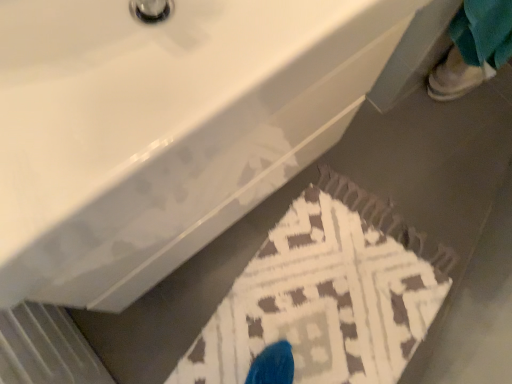
Question: Is white glossy sink at upper center turned away from brown textured rug at lower center?

Choices:
 (A) no
 (B) yes

Answer: (A)

Question: Does white glossy sink at upper center have a larger size compared to brown textured rug at lower center?

Choices:
 (A) no
 (B) yes

Answer: (B)

Question: Is white glossy sink at upper center at the left side of brown textured rug at lower center?

Choices:
 (A) no
 (B) yes

Answer: (B)

Question: Considering the relative sizes of white glossy sink at upper center and brown textured rug at lower center in the image provided, is white glossy sink at upper center thinner than brown textured rug at lower center?

Choices:
 (A) yes
 (B) no

Answer: (A)

Question: Is white glossy sink at upper center at the right side of brown textured rug at lower center?

Choices:
 (A) no
 (B) yes

Answer: (A)

Question: Could you tell me if white glossy sink at upper center is turned towards brown textured rug at lower center?

Choices:
 (A) no
 (B) yes

Answer: (A)

Question: Is brown textured rug at lower center directly adjacent to white glossy sink at upper center?

Choices:
 (A) no
 (B) yes

Answer: (A)

Question: Does brown textured rug at lower center come in front of white glossy sink at upper center?

Choices:
 (A) no
 (B) yes

Answer: (A)

Question: Is brown textured rug at lower center smaller than white glossy sink at upper center?

Choices:
 (A) yes
 (B) no

Answer: (A)

Question: Does brown textured rug at lower center have a lesser height compared to white glossy sink at upper center?

Choices:
 (A) no
 (B) yes

Answer: (B)

Question: Does brown textured rug at lower center have a larger size compared to white glossy sink at upper center?

Choices:
 (A) no
 (B) yes

Answer: (A)

Question: Is brown textured rug at lower center not within white glossy sink at upper center?

Choices:
 (A) no
 (B) yes

Answer: (B)

Question: From a real-world perspective, does brown textured rug at lower center sit lower than white leather shoe at upper right?

Choices:
 (A) yes
 (B) no

Answer: (A)